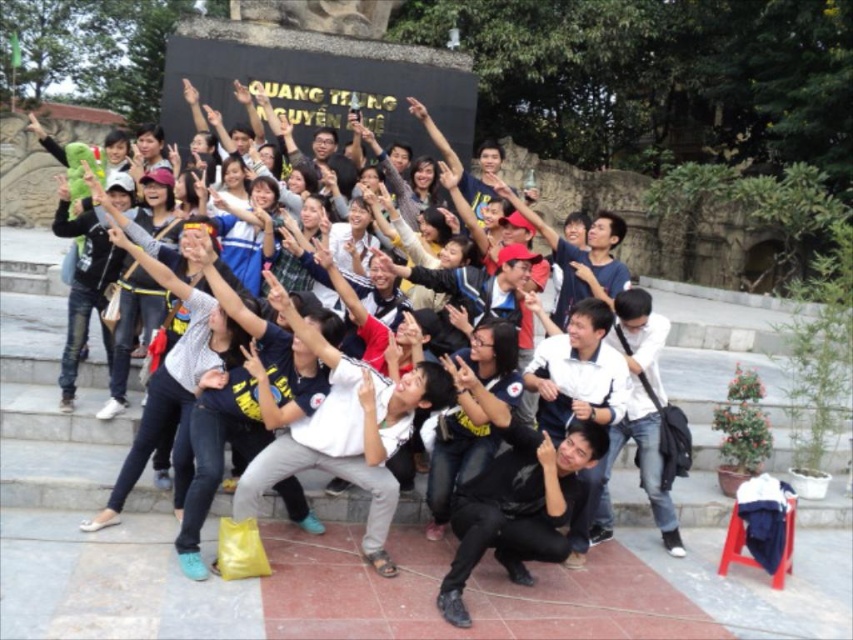
Can you confirm if white matte shirt at center is positioned above smooth skin hand at center?

Incorrect, white matte shirt at center is not positioned above smooth skin hand at center.

This screenshot has height=640, width=853. Find the location of `white matte shirt at center`. white matte shirt at center is located at coordinates (573, 353).

At what (x,y) coordinates should I click in order to perform the action: click on white matte shirt at center. Please return your answer as a coordinate pair (x, y). Looking at the image, I should click on (573, 353).

Who is more distant from viewer, (552, 465) or (425, 109)?

Positioned behind is point (425, 109).

Can you confirm if matte black hand at center is positioned to the left of smooth skin hand at center?

In fact, matte black hand at center is to the right of smooth skin hand at center.

Is point (550, 456) less distant than point (422, 112)?

Yes, point (550, 456) is in front of point (422, 112).

Find the location of a particular element. Image resolution: width=853 pixels, height=640 pixels. matte black hand at center is located at coordinates (546, 452).

Is white matte shirt at center positioned before matte black hand at center?

That is True.

Is point (476, 484) farther from camera compared to point (553, 468)?

Yes, it is.

You are a GUI agent. You are given a task and a screenshot of the screen. Output one action in this format:
    pyautogui.click(x=<x>, y=<y>)
    Task: Click on the white matte shirt at center
    
    Given the screenshot: What is the action you would take?
    pyautogui.click(x=573, y=353)